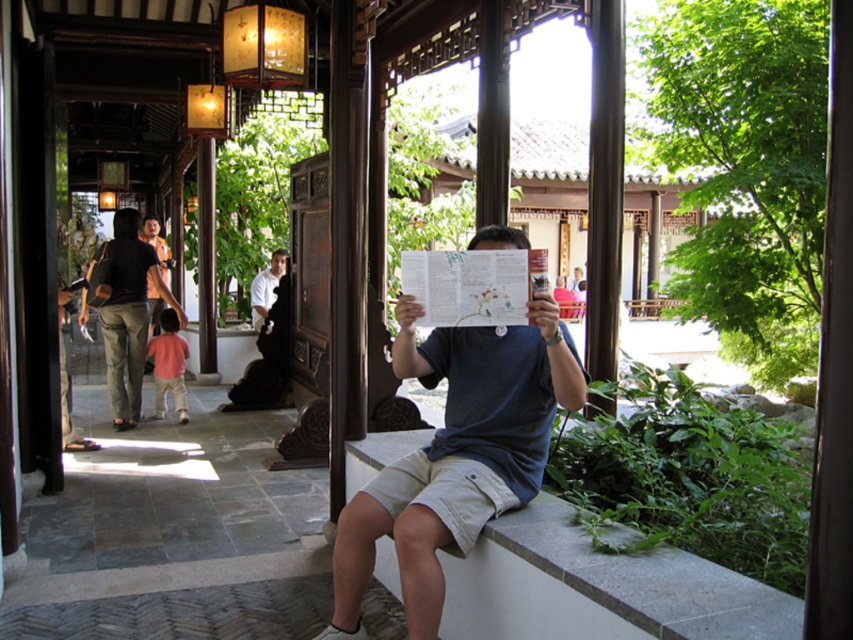
Question: From the image, what is the correct spatial relationship of white stone ledge at center in relation to light pink cotton shirt at lower left?

Choices:
 (A) left
 (B) right

Answer: (B)

Question: Which object is farther from the camera taking this photo?

Choices:
 (A) light pink cotton shirt at lower left
 (B) dark blue t-shirt at center

Answer: (A)

Question: Can you confirm if light pink cotton shirt at lower left is bigger than white shirt at center?

Choices:
 (A) yes
 (B) no

Answer: (B)

Question: Which of the following is the closest to the observer?

Choices:
 (A) light pink cotton shirt at lower left
 (B) white stone ledge at center
 (C) khaki pants at left

Answer: (B)

Question: Which of the following is the farthest from the observer?

Choices:
 (A) (113, 355)
 (B) (273, 278)
 (C) (433, 339)

Answer: (B)

Question: Does white stone ledge at center have a larger size compared to white shirt at center?

Choices:
 (A) yes
 (B) no

Answer: (B)